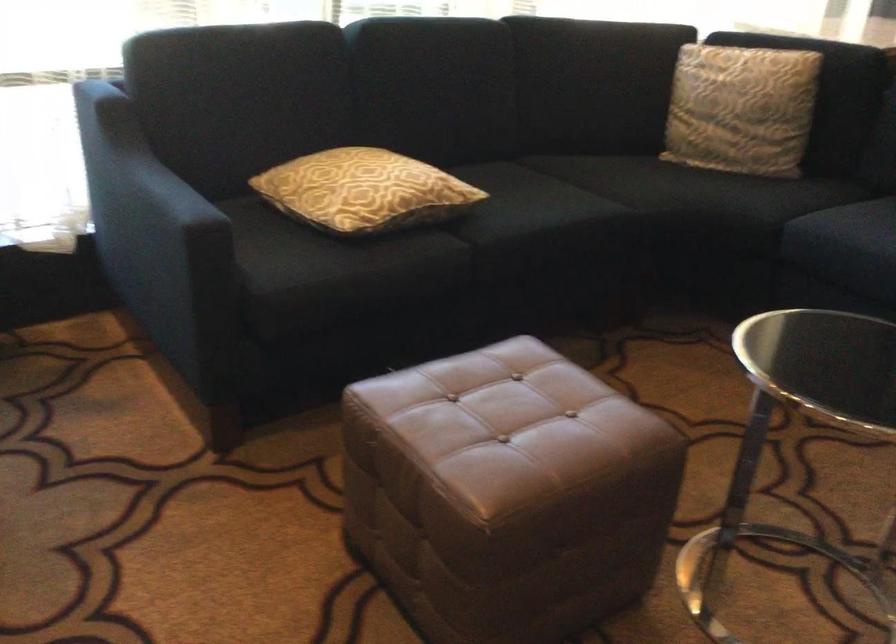
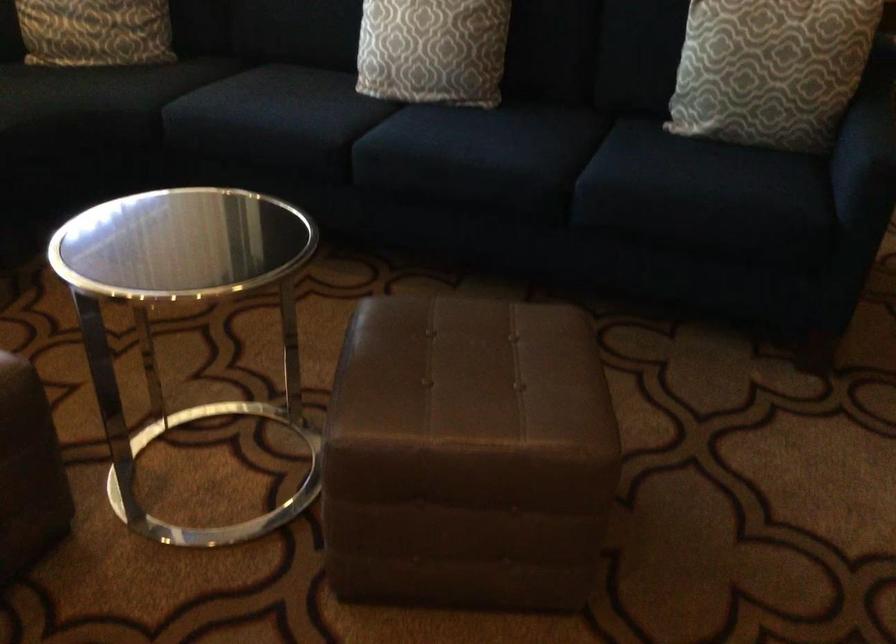
Question: How did the camera likely rotate?

Choices:
 (A) Left
 (B) Right
 (C) Up
 (D) Down

Answer: (B)